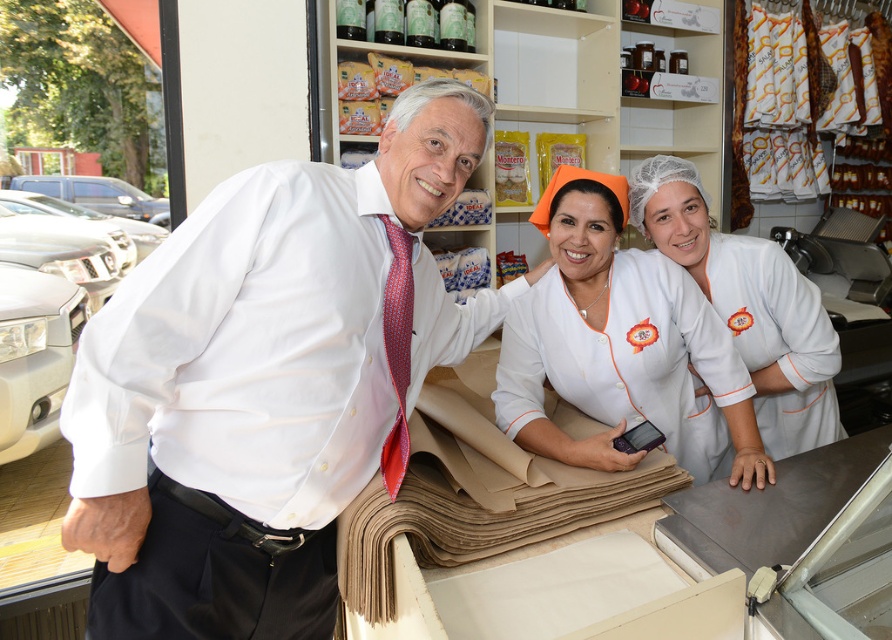
Is point (200, 625) positioned in front of point (380, 614)?

Yes, point (200, 625) is closer to viewer.

Can you confirm if white smooth shirt at center is positioned below brown paper at center?

Incorrect, white smooth shirt at center is not positioned below brown paper at center.

Who is more distant from viewer, [105,426] or [428,492]?

The point [428,492] is more distant.

This screenshot has width=892, height=640. Identify the location of white smooth shirt at center. click(267, 381).

Does white fabric at center have a smaller size compared to white fabric uniform at center?

Incorrect, white fabric at center is not smaller in size than white fabric uniform at center.

Which is more to the left, white fabric at center or white fabric uniform at center?

Positioned to the left is white fabric at center.

Which is behind, point (583, 365) or point (802, 317)?

Point (802, 317)

At what (x,y) coordinates should I click in order to perform the action: click on white fabric at center. Please return your answer as a coordinate pair (x, y). The height and width of the screenshot is (640, 892). Looking at the image, I should click on (618, 342).

Who is positioned more to the right, brown paper at center or white fabric uniform at center?

white fabric uniform at center is more to the right.

Can you confirm if brown paper at center is wider than white fabric uniform at center?

Correct, the width of brown paper at center exceeds that of white fabric uniform at center.

Which is in front, point (403, 483) or point (760, 358)?

Point (403, 483)

Locate an element on the screen. brown paper at center is located at coordinates (476, 492).